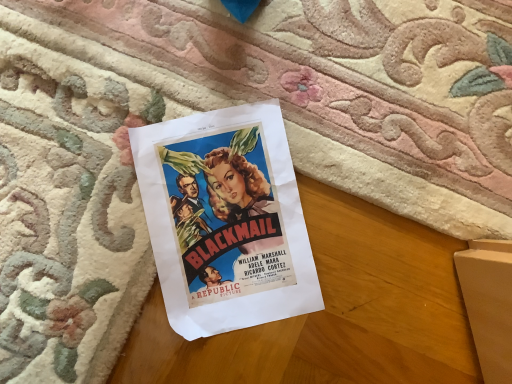
You are a GUI agent. You are given a task and a screenshot of the screen. Output one action in this format:
    pyautogui.click(x=<x>, y=<y>)
    Task: Click on the free space above matte paper poster at center (from a real-world perspective)
    The width and height of the screenshot is (512, 384).
    Given the screenshot: What is the action you would take?
    pyautogui.click(x=215, y=204)